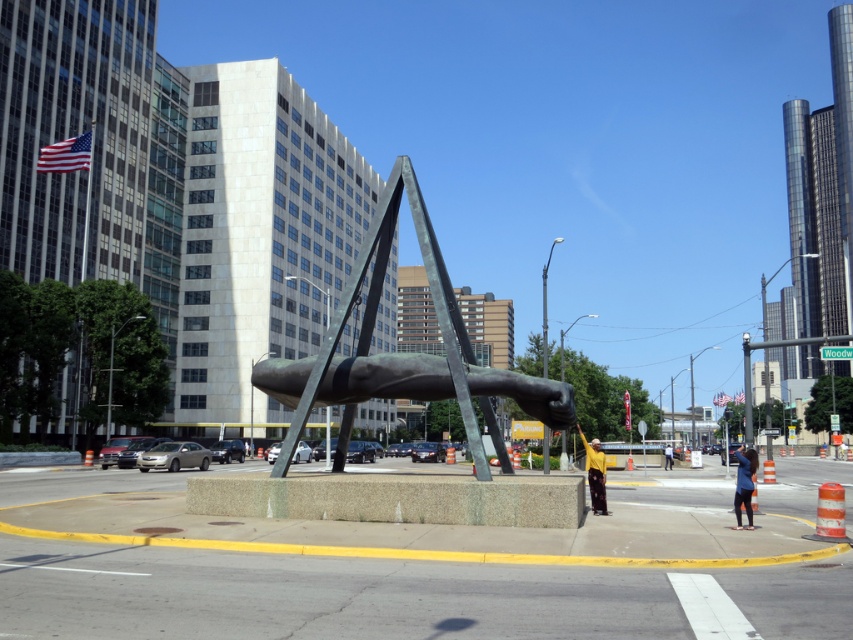
Is bronze sculpture at center below blue denim jeans at lower right?

No, bronze sculpture at center is not below blue denim jeans at lower right.

Which of these two, bronze sculpture at center or blue denim jeans at lower right, stands taller?

blue denim jeans at lower right

Who is more forward, (437, 387) or (743, 492)?

Point (743, 492) is in front.

Locate an element on the screen. bronze sculpture at center is located at coordinates (405, 355).

Can you confirm if bronze sculpture at center is thinner than dark blue jeans at center?

Yes.

Does point (299, 394) come farther from viewer compared to point (666, 449)?

That is False.

The image size is (853, 640). I want to click on bronze sculpture at center, so click(x=405, y=355).

Who is positioned more to the right, yellow matte shirt at center or dark blue jeans at center?

From the viewer's perspective, dark blue jeans at center appears more on the right side.

You are a GUI agent. You are given a task and a screenshot of the screen. Output one action in this format:
    pyautogui.click(x=<x>, y=<y>)
    Task: Click on the yellow matte shirt at center
    
    Given the screenshot: What is the action you would take?
    click(x=595, y=474)